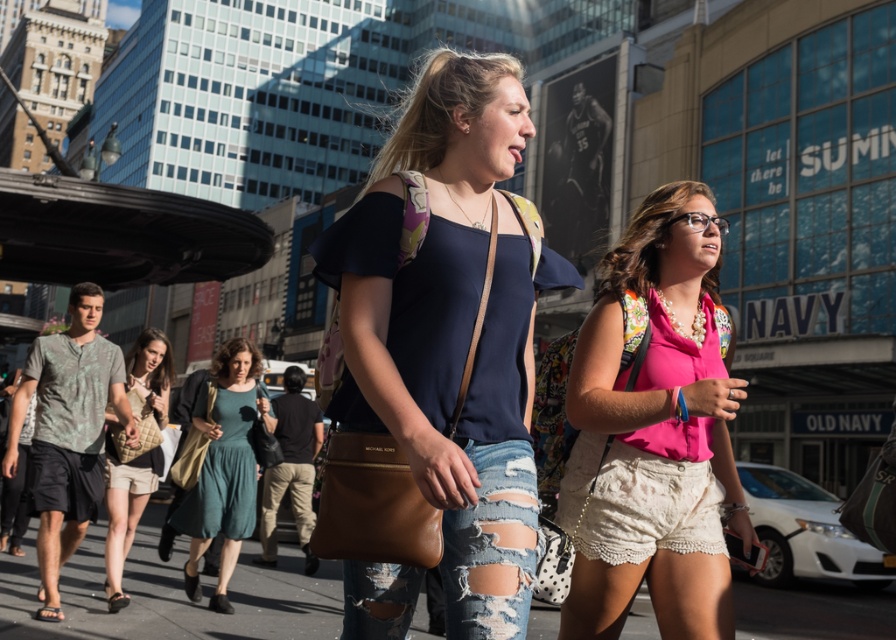
Question: Is matte blue top at center above green textured shirt at left?

Choices:
 (A) yes
 (B) no

Answer: (A)

Question: Can you confirm if ripped denim jeans at center is wider than beige quilted purse at center?

Choices:
 (A) no
 (B) yes

Answer: (B)

Question: Can you confirm if pink fabric blouse at center is bigger than green textured shirt at left?

Choices:
 (A) yes
 (B) no

Answer: (A)

Question: Estimate the real-world distances between objects in this image. Which object is farther from the ripped denim jeans at center?

Choices:
 (A) teal fabric dress at center
 (B) matte blue top at center
 (C) pink fabric blouse at center

Answer: (B)

Question: Which of the following is the closest to the observer?

Choices:
 (A) pyautogui.click(x=118, y=378)
 (B) pyautogui.click(x=96, y=577)

Answer: (A)

Question: Which of the following is the closest to the observer?

Choices:
 (A) (229, 554)
 (B) (602, 368)
 (C) (122, 461)
 (D) (480, 264)

Answer: (D)